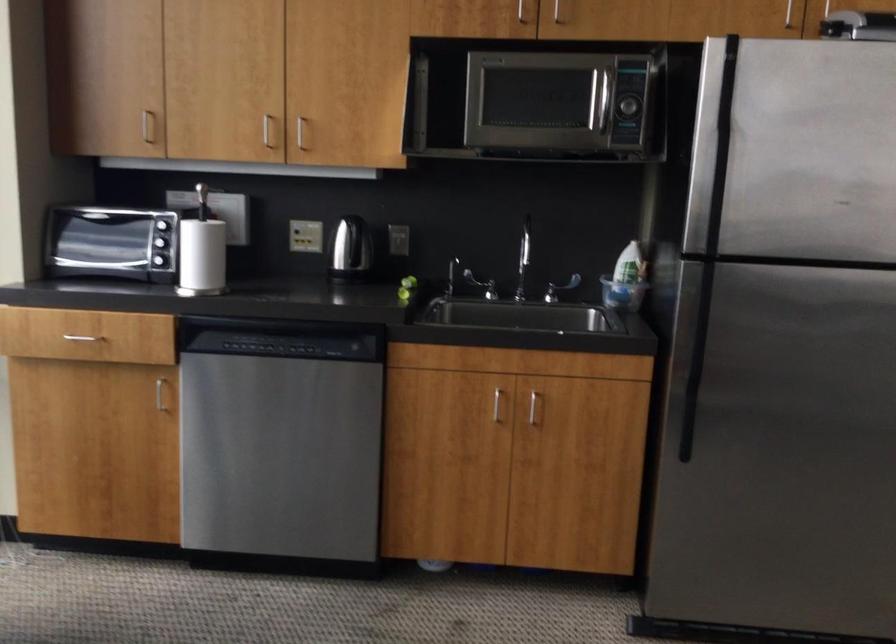
Describe the element at coordinates (602, 106) in the screenshot. I see `the microwave door handle` at that location.